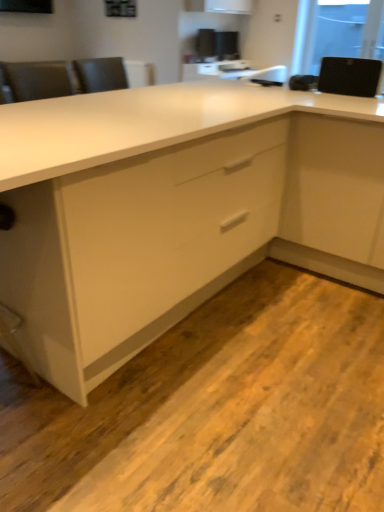
Question: Is transparent glass window screen at upper right in front of or behind black matte speaker at upper right in the image?

Choices:
 (A) front
 (B) behind

Answer: (B)

Question: From their relative heights in the image, would you say transparent glass window screen at upper right is taller or shorter than black matte speaker at upper right?

Choices:
 (A) tall
 (B) short

Answer: (A)

Question: Estimate the real-world distances between objects in this image. Which object is closer to the black matte speaker at upper right?

Choices:
 (A) white glossy cabinet at center
 (B) transparent glass window screen at upper right

Answer: (A)

Question: Estimate the real-world distances between objects in this image. Which object is farther from the black matte speaker at upper right?

Choices:
 (A) transparent glass window screen at upper right
 (B) white glossy cabinet at center

Answer: (A)